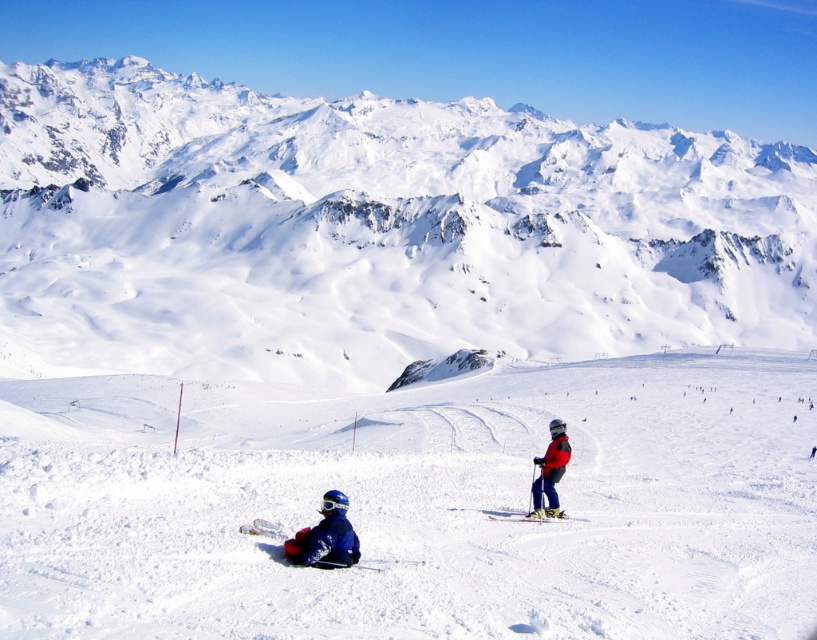
Based on the photo, does white snow ski slope at center have a greater height compared to red ski suit at center?

Correct, white snow ski slope at center is much taller as red ski suit at center.

Is white snow ski slope at center wider than red ski suit at center?

Indeed, white snow ski slope at center has a greater width compared to red ski suit at center.

Is point (494, 490) closer to viewer compared to point (565, 468)?

That is False.

Identify the location of white snow ski slope at center. The width and height of the screenshot is (817, 640). (417, 502).

Can you confirm if white snow-covered mountain range at upper center is taller than shiny metallic ski at lower right?

Indeed, white snow-covered mountain range at upper center has a greater height compared to shiny metallic ski at lower right.

Describe the element at coordinates (374, 230) in the screenshot. I see `white snow-covered mountain range at upper center` at that location.

Is point (315, 173) farther from camera compared to point (514, 518)?

Yes, it is behind point (514, 518).

Find the location of a particular element. This screenshot has height=640, width=817. white snow-covered mountain range at upper center is located at coordinates (374, 230).

This screenshot has width=817, height=640. What are the coordinates of `white snow-covered mountain range at upper center` in the screenshot? It's located at (374, 230).

Which is behind, point (186, 132) or point (556, 499)?

Point (186, 132)

You are a GUI agent. You are given a task and a screenshot of the screen. Output one action in this format:
    pyautogui.click(x=<x>, y=<y>)
    Task: Click on the white snow-covered mountain range at upper center
    This screenshot has width=817, height=640.
    Given the screenshot: What is the action you would take?
    pyautogui.click(x=374, y=230)